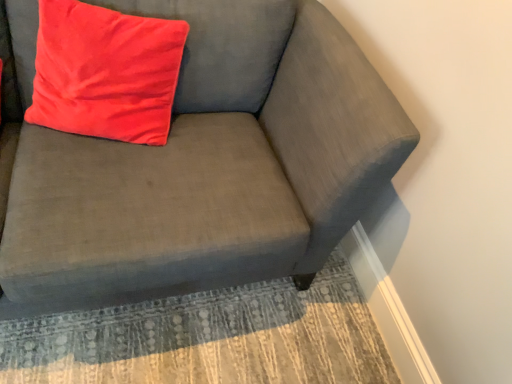
Question: Based on their sizes in the image, would you say textured beige rug at lower center is bigger or smaller than matte gray couch at upper right?

Choices:
 (A) big
 (B) small

Answer: (B)

Question: Relative to matte gray couch at upper right, is textured beige rug at lower center in front or behind?

Choices:
 (A) behind
 (B) front

Answer: (A)

Question: Which object is the farthest from the textured beige rug at lower center?

Choices:
 (A) matte red pillow at upper left
 (B) matte gray couch at upper right

Answer: (A)

Question: Which object is positioned closest to the matte red pillow at upper left?

Choices:
 (A) matte gray couch at upper right
 (B) textured beige rug at lower center

Answer: (A)